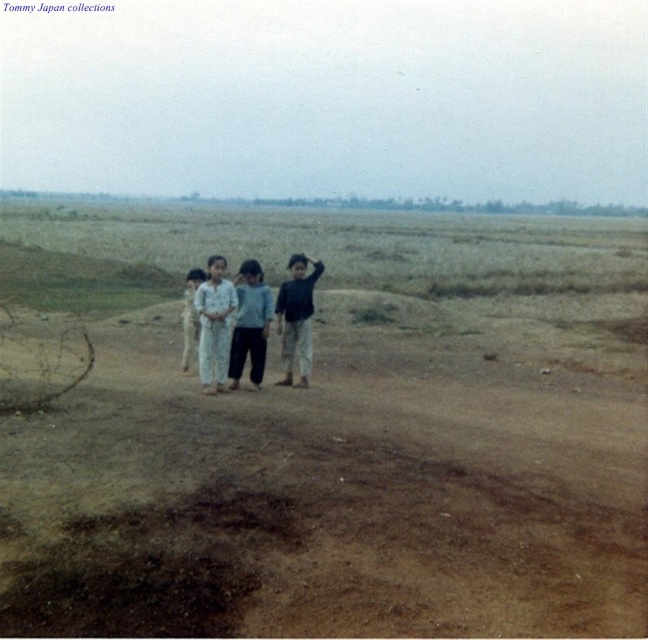
Question: Which is farther from the white cotton pants at center?

Choices:
 (A) dark blue shirt at center
 (B) light beige pants at center

Answer: (B)

Question: Does white cotton pants at center have a greater width compared to dark blue shirt at center?

Choices:
 (A) no
 (B) yes

Answer: (A)

Question: Which object is closer to the camera taking this photo?

Choices:
 (A) light blue denim jacket at center
 (B) light beige pants at center
 (C) dark blue shirt at center
 (D) white cotton pants at center

Answer: (D)

Question: Which of the following is the farthest from the observer?

Choices:
 (A) light blue denim jacket at center
 (B) white cotton pants at center

Answer: (A)

Question: Is white cotton pants at center smaller than light beige pants at center?

Choices:
 (A) no
 (B) yes

Answer: (B)

Question: Can you confirm if white cotton pants at center is smaller than light blue denim jacket at center?

Choices:
 (A) no
 (B) yes

Answer: (B)